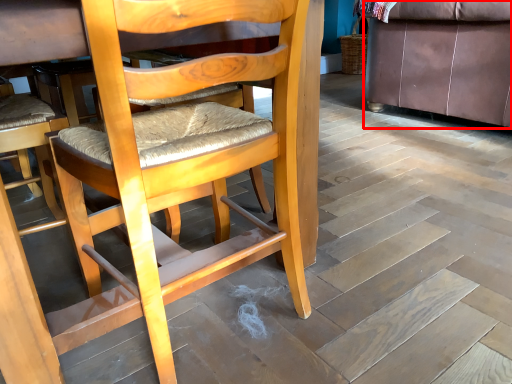
Question: From the image's perspective, what is the correct spatial relationship of studio couch (annotated by the red box) in relation to chair?

Choices:
 (A) above
 (B) below

Answer: (A)